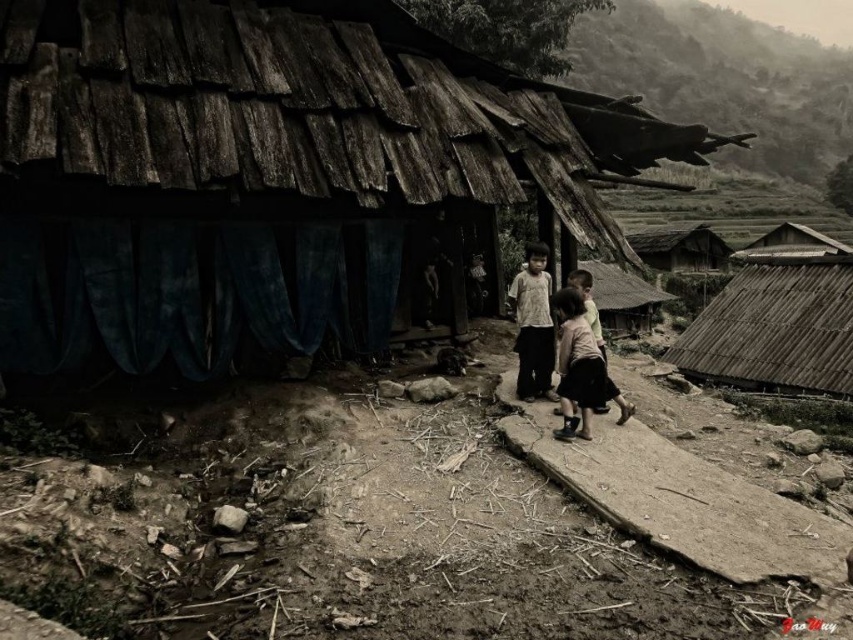
Question: Is the position of wooden shingles hut at upper right less distant than that of wooden thatched hut at center?

Choices:
 (A) no
 (B) yes

Answer: (A)

Question: Which point appears farthest from the camera in this image?

Choices:
 (A) [648, 256]
 (B) [618, 392]

Answer: (A)

Question: Which of these objects is positioned farthest from the wooden shingles hut at center?

Choices:
 (A) wooden shingles hut at upper right
 (B) thatched roof hut at upper right

Answer: (B)

Question: Does light brown cotton dress at center have a lesser width compared to light brown fabric skirt at center?

Choices:
 (A) yes
 (B) no

Answer: (A)

Question: Among these objects, which one is farthest from the camera?

Choices:
 (A) wooden shingles hut at center
 (B) light brown fabric skirt at center
 (C) thatched roof hut at upper right
 (D) wooden shingles hut at upper right

Answer: (C)

Question: In this image, where is light brown cotton dress at center located relative to wooden thatched hut at center?

Choices:
 (A) below
 (B) above

Answer: (A)